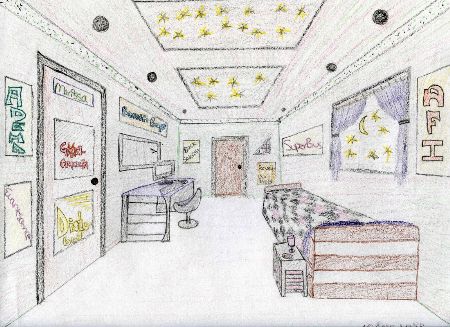
Identify the location of ceiling. The height and width of the screenshot is (327, 450). (328, 46).